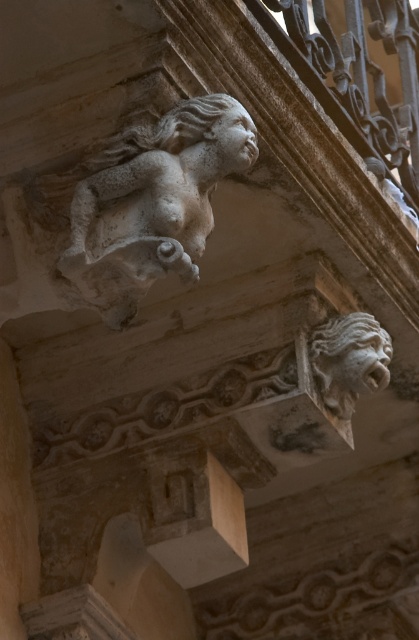
Question: Which point is closer to the camera?

Choices:
 (A) (227, 157)
 (B) (74, 257)

Answer: (B)

Question: Does white stone cherub at upper left have a greater width compared to rough stone gargoyle at upper right?

Choices:
 (A) yes
 (B) no

Answer: (A)

Question: Which point is closer to the camera?

Choices:
 (A) (359, 342)
 (B) (232, 150)

Answer: (B)

Question: Is white stone cherub at upper left wider than smooth stone face at upper center?

Choices:
 (A) no
 (B) yes

Answer: (B)

Question: Which point is closer to the camera taking this photo?

Choices:
 (A) (92, 209)
 (B) (377, 385)
 (C) (387, 376)

Answer: (A)

Question: Can you confirm if white stone cherub at upper left is thinner than rough stone gargoyle at upper right?

Choices:
 (A) no
 (B) yes

Answer: (A)